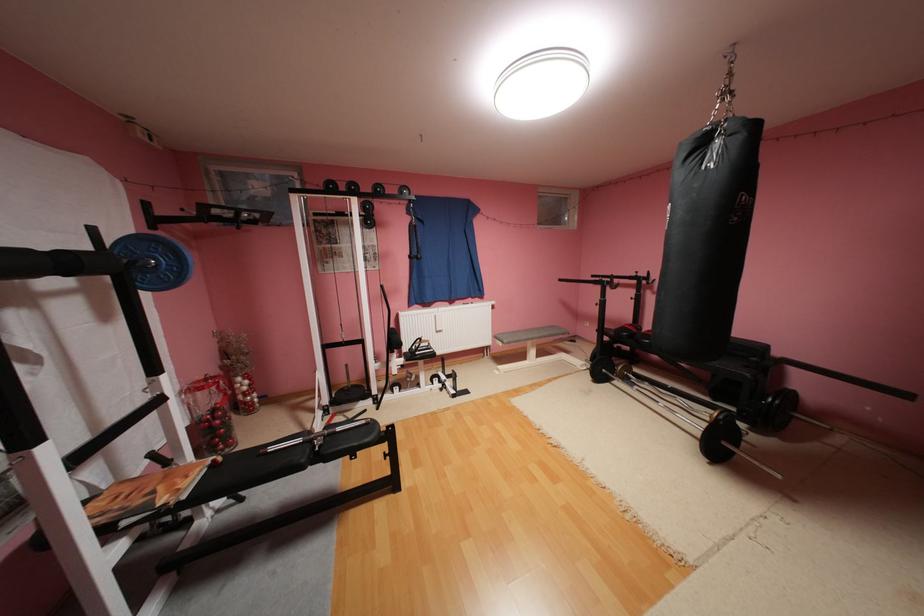
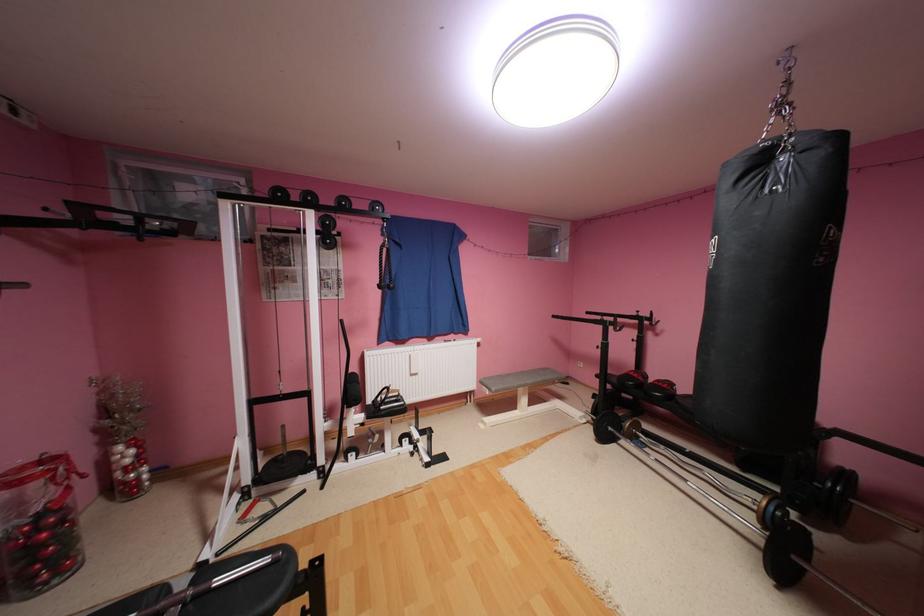
Question: How did the camera likely rotate?

Choices:
 (A) Left
 (B) Right
 (C) Up
 (D) Down

Answer: (C)